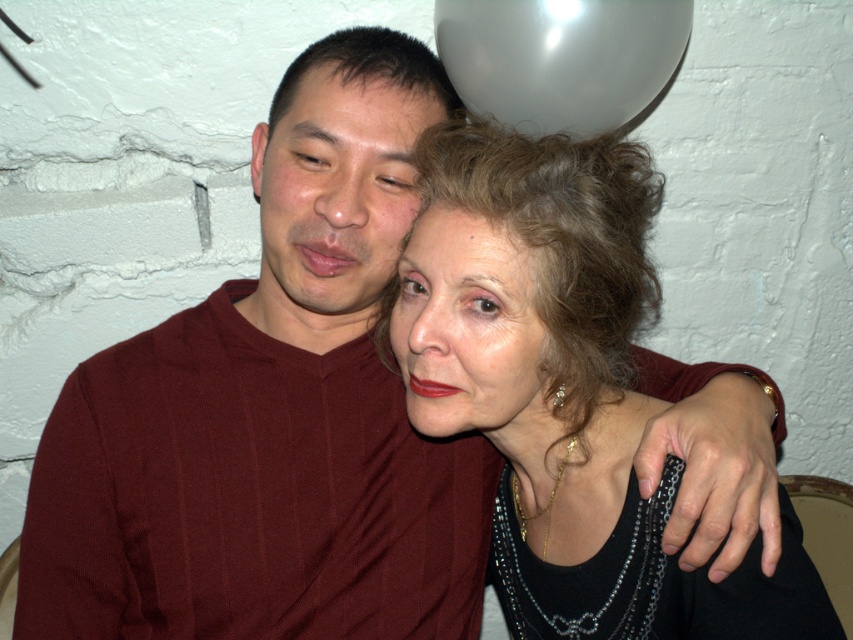
Who is positioned more to the right, matte black face at center or white glossy balloon at upper center?

white glossy balloon at upper center is more to the right.

Consider the image. Is matte black face at center in front of white glossy balloon at upper center?

Yes, matte black face at center is closer to the viewer.

Identify the location of matte black face at center. The image size is (853, 640). (469, 332).

Is white glossy balloon at upper center to the right of matte black forehead at upper center from the viewer's perspective?

Indeed, white glossy balloon at upper center is positioned on the right side of matte black forehead at upper center.

Does white glossy balloon at upper center have a greater width compared to matte black forehead at upper center?

Indeed, white glossy balloon at upper center has a greater width compared to matte black forehead at upper center.

Between point (463, 68) and point (291, 84), which one is positioned in front?

Point (291, 84) is more forward.

Locate an element on the screen. Image resolution: width=853 pixels, height=640 pixels. white glossy balloon at upper center is located at coordinates pos(560,58).

Between matte black necklace at center and matte black face at center, which one is positioned lower?

matte black necklace at center

Who is more distant from viewer, (555,604) or (461,387)?

Point (555,604)

Is point (590, 300) less distant than point (438, 205)?

That is True.

Locate an element on the screen. The height and width of the screenshot is (640, 853). matte black necklace at center is located at coordinates (563, 387).